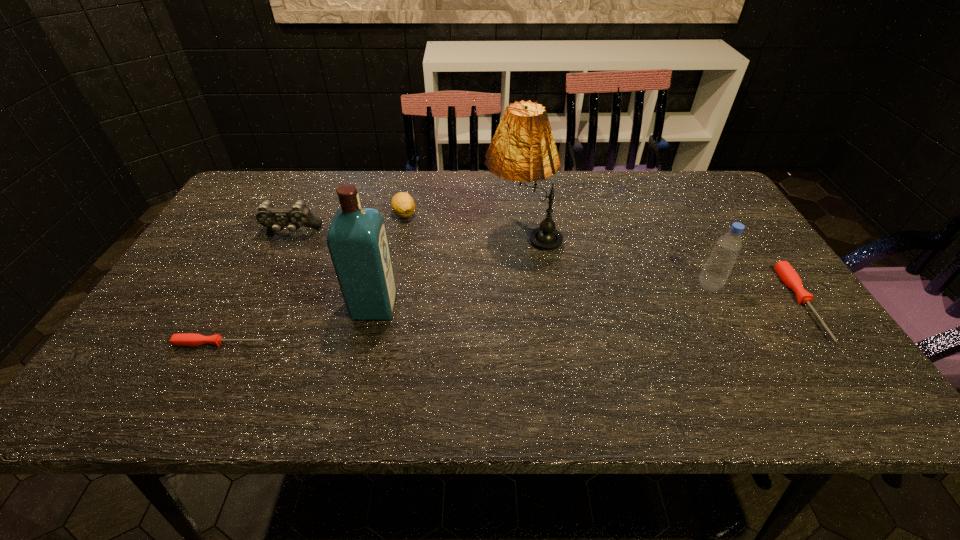
This screenshot has width=960, height=540. I want to click on the left screwdriver, so click(184, 339).

You are a GUI agent. You are given a task and a screenshot of the screen. Output one action in this format:
    pyautogui.click(x=<x>, y=<y>)
    Task: Click on the shortest object
    The width and height of the screenshot is (960, 540).
    Given the screenshot: What is the action you would take?
    pyautogui.click(x=184, y=339)

The height and width of the screenshot is (540, 960). I want to click on the taller screwdriver, so click(x=785, y=271).

Find the location of a particular element. This screenshot has width=960, height=540. the second shortest object is located at coordinates coord(785,271).

This screenshot has height=540, width=960. Identify the location of lampshade. (523, 149).

Find the location of a particular element. The height and width of the screenshot is (540, 960). control is located at coordinates (299, 215).

Identify the location of lemon. (x=403, y=205).

This screenshot has height=540, width=960. What are the coordinates of `bottle` in the screenshot? It's located at (715, 273).

Identify the location of the sixth object from left to right. [x=715, y=273].

Find the location of a particular element. This screenshot has height=540, width=960. liquor is located at coordinates (357, 240).